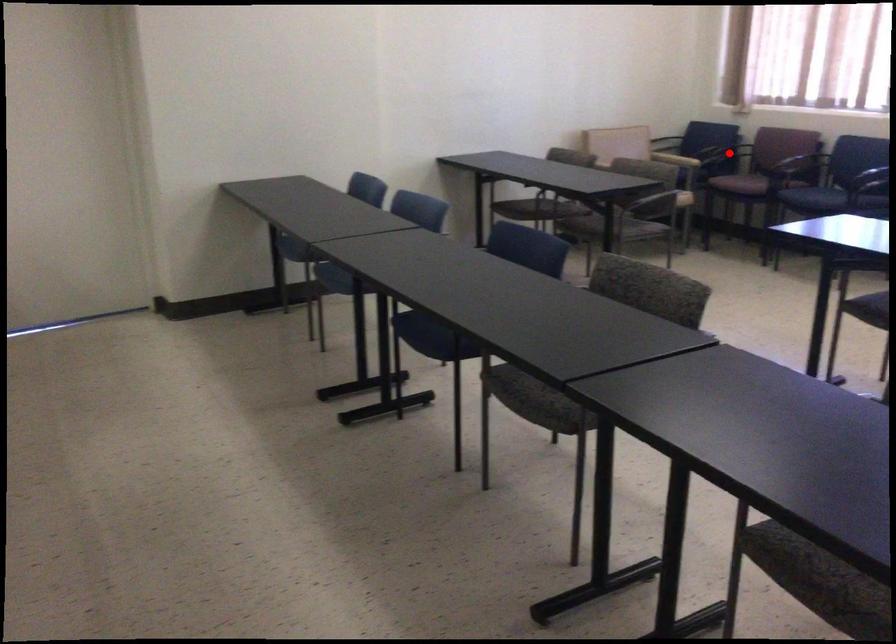
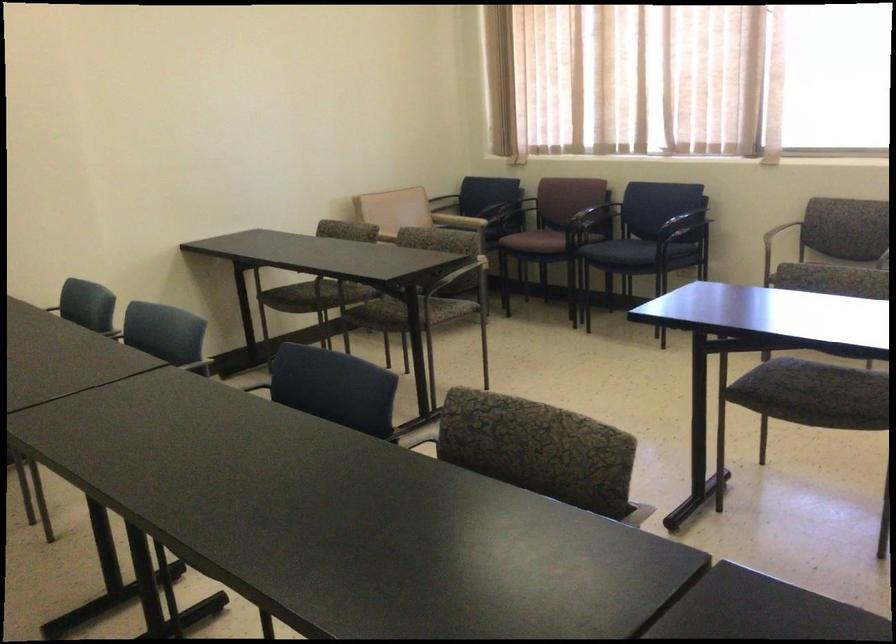
Question: I am providing you with two images of the same scene from different viewpoints. A red point is marked on the first image. Can you still see the location of the red point in image 2?

Choices:
 (A) Yes
 (B) No

Answer: (B)